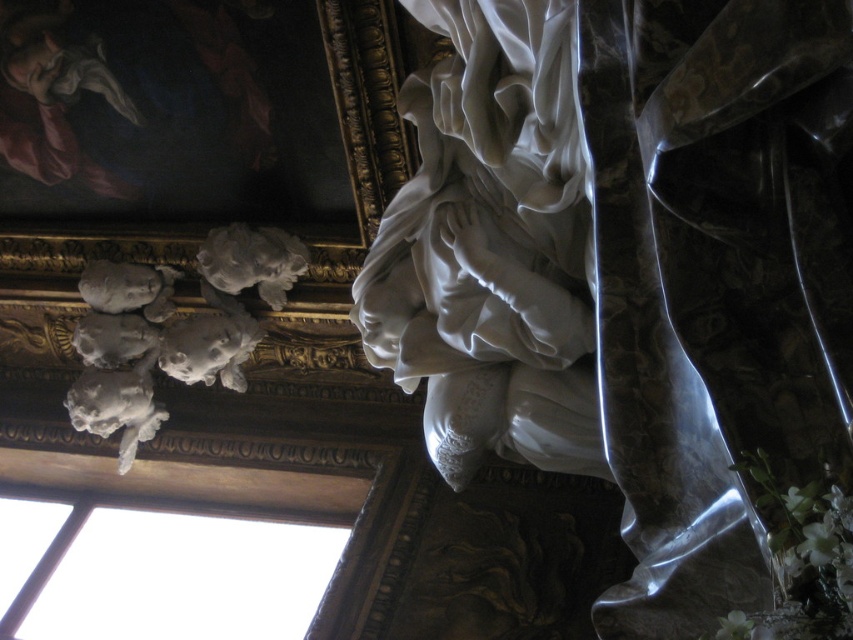
Is point (1, 532) closer to camera compared to point (227, 330)?

No, (1, 532) is behind (227, 330).

What do you see at coordinates (184, 577) in the screenshot?
I see `transparent glass window at upper left` at bounding box center [184, 577].

Identify the location of transparent glass window at upper left. This screenshot has height=640, width=853. (184, 577).

Does white marble statue at center appear under white marble cherubs at upper left?

No.

Is white marble statue at center bigger than white marble cherubs at upper left?

Actually, white marble statue at center might be smaller than white marble cherubs at upper left.

This screenshot has height=640, width=853. What do you see at coordinates (631, 269) in the screenshot? I see `white marble statue at center` at bounding box center [631, 269].

Identify the location of white marble statue at center. The width and height of the screenshot is (853, 640). (631, 269).

Between white marble statue at center and transparent glass window at upper left, which one is positioned higher?

white marble statue at center is above.

Does point (728, 419) come in front of point (234, 602)?

Yes, it is.

What are the coordinates of `white marble statue at center` in the screenshot? It's located at (631, 269).